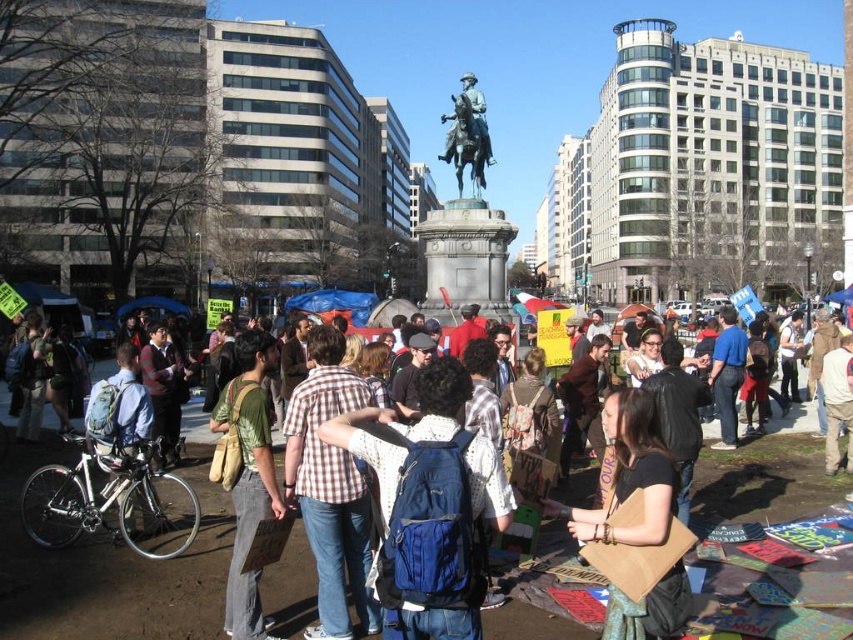
Which of these two, plaid shirt at center or blue fabric backpack at center, stands taller?

blue fabric backpack at center is taller.

The width and height of the screenshot is (853, 640). Find the location of `plaid shirt at center`. plaid shirt at center is located at coordinates (111, 563).

Where is `plaid shirt at center`? The height and width of the screenshot is (640, 853). plaid shirt at center is located at coordinates (111, 563).

Who is lower down, brown leather bag at center or bronze statue at center?

brown leather bag at center

Is brown leather bag at center bigger than bronze statue at center?

Incorrect, brown leather bag at center is not larger than bronze statue at center.

Which is in front, point (670, 557) or point (456, 134)?

Point (670, 557) is in front.

The height and width of the screenshot is (640, 853). In order to click on brown leather bag at center in this screenshot , I will do `click(636, 529)`.

At what (x,y) coordinates should I click in order to perform the action: click on brown leather bag at center. Please return your answer as a coordinate pair (x, y). This screenshot has width=853, height=640. Looking at the image, I should click on (636, 529).

Which is in front, point (569, 513) or point (250, 401)?

Point (569, 513)

Is point (631, 474) behind point (234, 353)?

No, it is not.

Where is `brown leather bag at center`? brown leather bag at center is located at coordinates (636, 529).